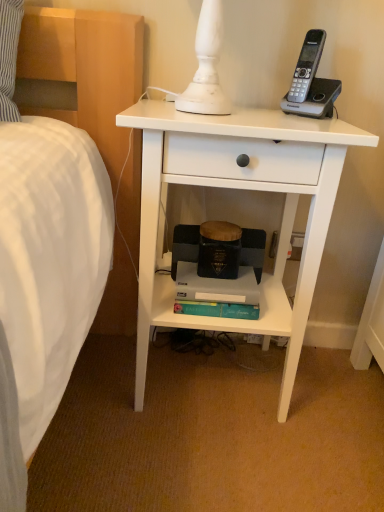
I want to click on vacant space situated above teal matte paperback book at lower center (from a real-world perspective), so click(209, 276).